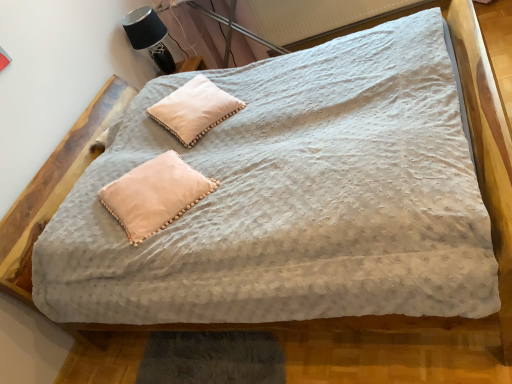
Question: From a real-world perspective, is white textured radiator at upper center on top of white soft pillow at upper center, the second pillow positioned from the bottom?

Choices:
 (A) yes
 (B) no

Answer: (B)

Question: From the image's perspective, does white textured radiator at upper center appear lower than white soft pillow at upper center, arranged as the 1th pillow when viewed from the back?

Choices:
 (A) no
 (B) yes

Answer: (A)

Question: Is white textured radiator at upper center oriented away from white soft pillow at upper center, the 1th pillow in the top-to-bottom sequence?

Choices:
 (A) yes
 (B) no

Answer: (B)

Question: Is white textured radiator at upper center oriented towards white soft pillow at upper center, the second pillow positioned from the bottom?

Choices:
 (A) no
 (B) yes

Answer: (B)

Question: Does white textured radiator at upper center appear on the left side of white soft pillow at upper center, acting as the second pillow starting from the front?

Choices:
 (A) no
 (B) yes

Answer: (A)

Question: Does white textured radiator at upper center have a greater width compared to white soft pillow at upper center, arranged as the 1th pillow when viewed from the back?

Choices:
 (A) yes
 (B) no

Answer: (B)

Question: From a real-world perspective, is white soft pillow at upper center, arranged as the 1th pillow when viewed from the back, positioned under pale pink fabric pillow at center, arranged as the 2th pillow when viewed from the top, based on gravity?

Choices:
 (A) yes
 (B) no

Answer: (B)

Question: Does white soft pillow at upper center, the 1th pillow in the top-to-bottom sequence, have a lesser height compared to pale pink fabric pillow at center, positioned as the second pillow in back-to-front order?

Choices:
 (A) no
 (B) yes

Answer: (A)

Question: From the image's perspective, is white soft pillow at upper center, acting as the second pillow starting from the front, over pale pink fabric pillow at center, acting as the 1th pillow starting from the bottom?

Choices:
 (A) yes
 (B) no

Answer: (A)

Question: Is white soft pillow at upper center, acting as the second pillow starting from the front, taller than pale pink fabric pillow at center, acting as the 1th pillow starting from the bottom?

Choices:
 (A) yes
 (B) no

Answer: (A)

Question: Considering the relative positions of white soft pillow at upper center, acting as the second pillow starting from the front, and pale pink fabric pillow at center, the 1th pillow in the front-to-back sequence, in the image provided, is white soft pillow at upper center, acting as the second pillow starting from the front, in front of pale pink fabric pillow at center, the 1th pillow in the front-to-back sequence,?

Choices:
 (A) yes
 (B) no

Answer: (B)

Question: Is white soft pillow at upper center, acting as the second pillow starting from the front, to the left of pale pink fabric pillow at center, arranged as the 2th pillow when viewed from the top, from the viewer's perspective?

Choices:
 (A) no
 (B) yes

Answer: (A)

Question: Considering the relative positions of black fabric table lamp at upper left and pale pink fabric pillow at center, acting as the 1th pillow starting from the bottom, in the image provided, is black fabric table lamp at upper left to the left of pale pink fabric pillow at center, acting as the 1th pillow starting from the bottom, from the viewer's perspective?

Choices:
 (A) no
 (B) yes

Answer: (B)